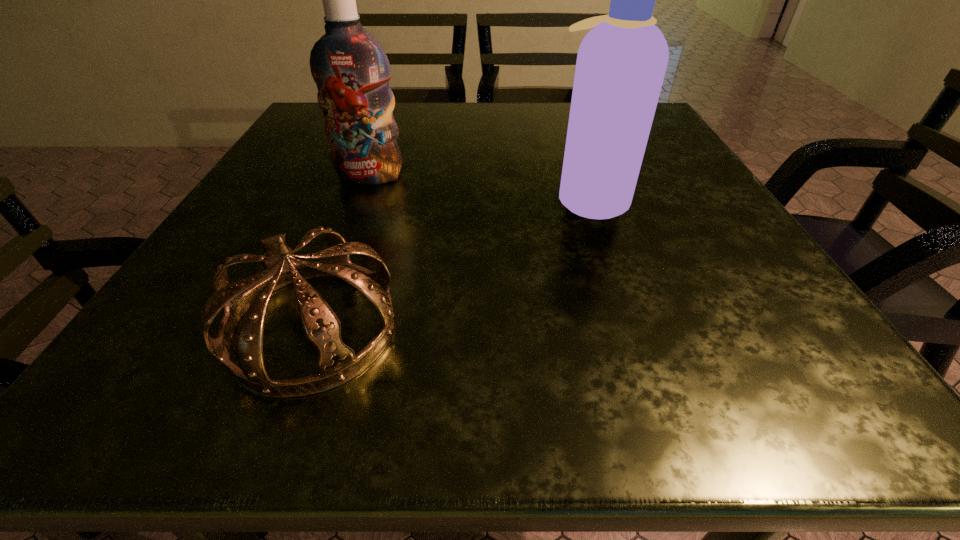
You are a GUI agent. You are given a task and a screenshot of the screen. Output one action in this format:
    pyautogui.click(x=<x>, y=<y>)
    Task: Click on the right shampoo
    Image resolution: width=960 pixels, height=540 pixels.
    Given the screenshot: What is the action you would take?
    pyautogui.click(x=621, y=63)

The height and width of the screenshot is (540, 960). Find the location of `the left shampoo`. the left shampoo is located at coordinates pos(351,70).

Where is `tiara`? This screenshot has height=540, width=960. tiara is located at coordinates (337, 364).

This screenshot has width=960, height=540. Identify the location of the shortest object. (337, 364).

Where is `free spot located 0.150m on the front of the rightmost object`? free spot located 0.150m on the front of the rightmost object is located at coordinates (620, 284).

Locate an element on the screen. vacant space situated 0.360m on the front label of the left shampoo is located at coordinates (313, 332).

Where is `vacant area situated 0.180m on the back of the tiara`? This screenshot has height=540, width=960. vacant area situated 0.180m on the back of the tiara is located at coordinates (358, 204).

Identify the location of object present at the near edge. (337, 364).

The width and height of the screenshot is (960, 540). Find the location of `shampoo present at the left edge`. shampoo present at the left edge is located at coordinates (351, 70).

Find the location of a particular element. The height and width of the screenshot is (540, 960). tiara that is positioned at the left edge is located at coordinates (337, 364).